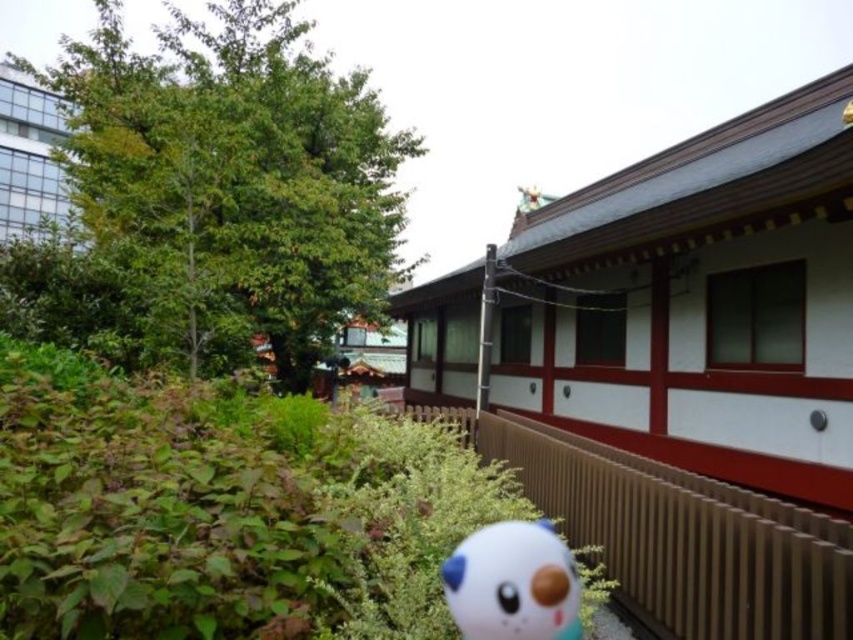
From the picture: Can you confirm if brown wooden rail at lower right is thinner than white glossy plush at lower center?

In fact, brown wooden rail at lower right might be wider than white glossy plush at lower center.

Can you confirm if brown wooden rail at lower right is positioned above white glossy plush at lower center?

Actually, brown wooden rail at lower right is below white glossy plush at lower center.

Which is behind, point (788, 513) or point (511, 524)?

Point (788, 513)

Where is `brown wooden rail at lower right`? The width and height of the screenshot is (853, 640). brown wooden rail at lower right is located at coordinates (677, 534).